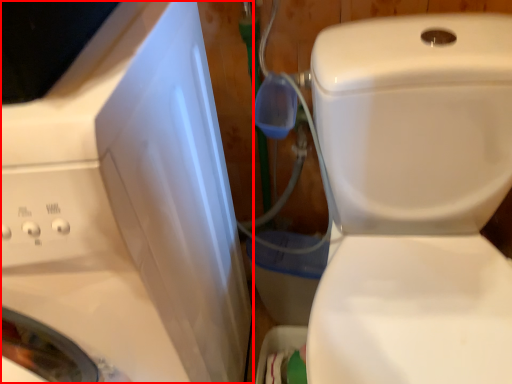
Question: In this image, where is washing machine (annotated by the red box) located relative to toilet?

Choices:
 (A) left
 (B) right

Answer: (A)